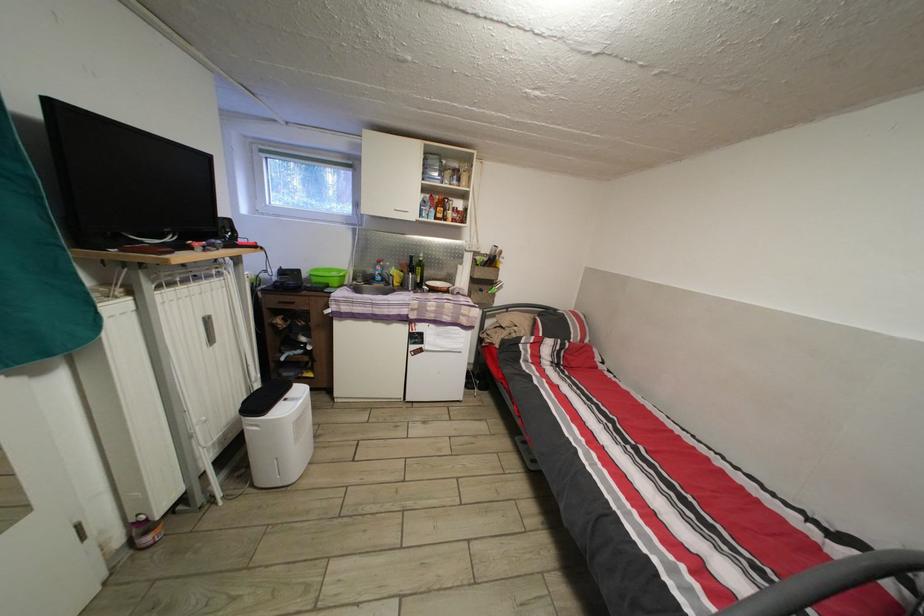
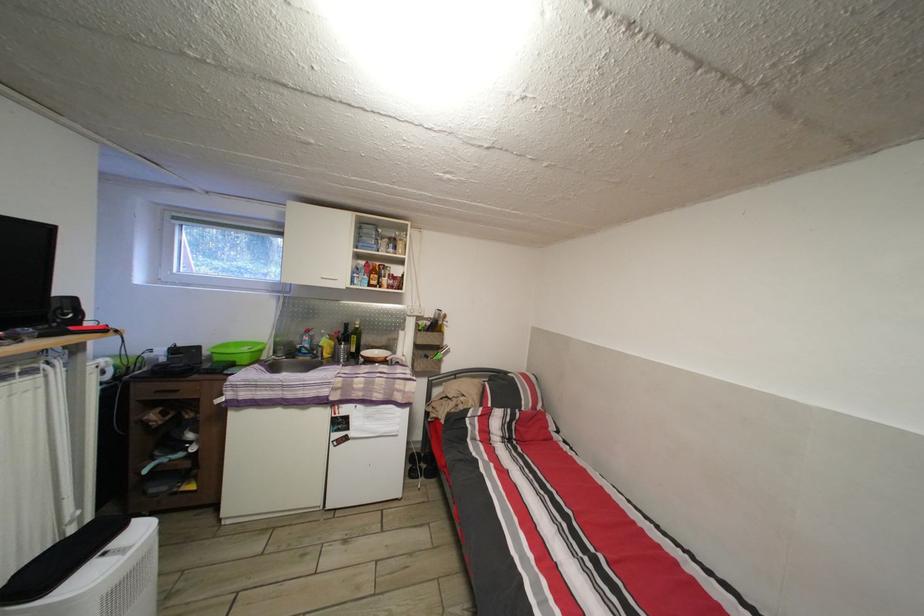
In the second image, find the point that corresponds to [311,282] in the first image.

(213, 359)